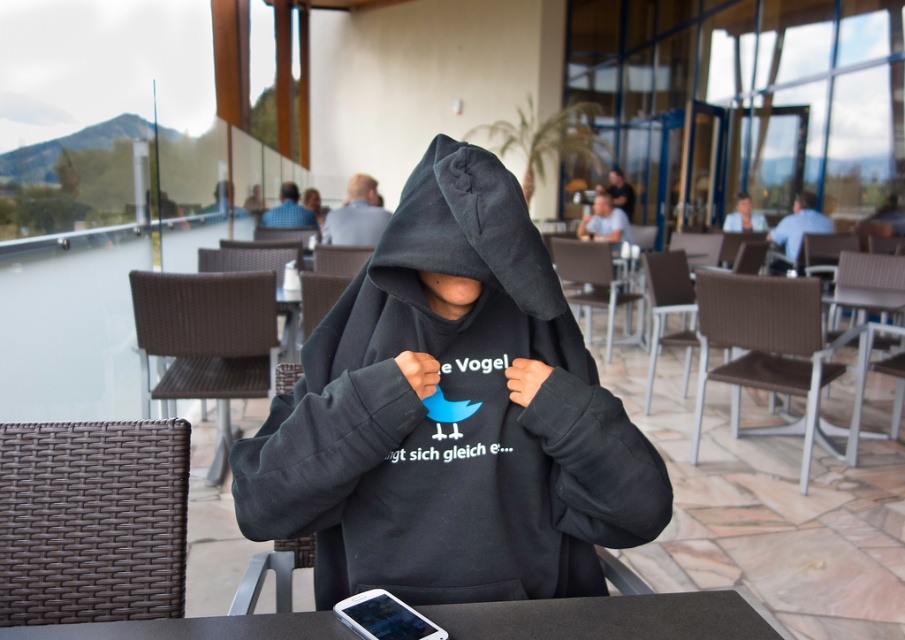
Between black cotton hoodie at center and blue shirt at upper center, which one has less height?

black cotton hoodie at center

Where is `black cotton hoodie at center`? black cotton hoodie at center is located at coordinates (465, 230).

Is black cotton hoodie at center to the right of dark gray hoodie at center from the viewer's perspective?

Correct, you'll find black cotton hoodie at center to the right of dark gray hoodie at center.

Does black cotton hoodie at center appear on the left side of dark gray hoodie at center?

In fact, black cotton hoodie at center is to the right of dark gray hoodie at center.

Describe the element at coordinates (465, 230) in the screenshot. I see `black cotton hoodie at center` at that location.

This screenshot has width=905, height=640. What are the coordinates of `black cotton hoodie at center` in the screenshot? It's located at (465, 230).

Who is more forward, (367, 196) or (744, 220)?

Point (367, 196) is in front.

The height and width of the screenshot is (640, 905). In order to click on dark gray hoodie at center in this screenshot , I will do `click(356, 214)`.

The image size is (905, 640). I want to click on dark gray hoodie at center, so click(x=356, y=214).